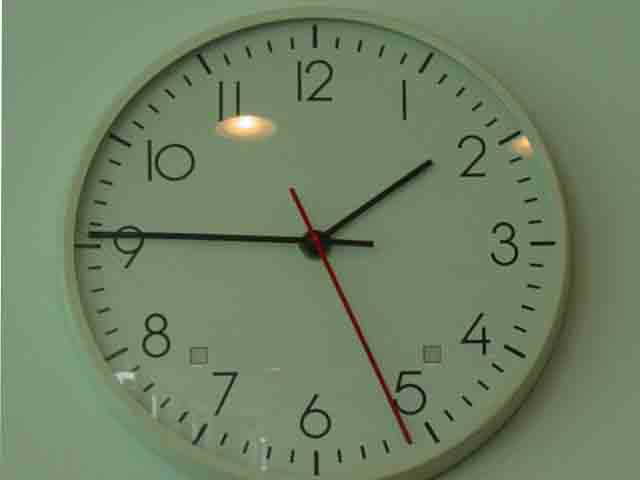
I want to click on clock secondhand, so click(294, 195), click(315, 238), click(349, 316), click(388, 392), click(408, 436).